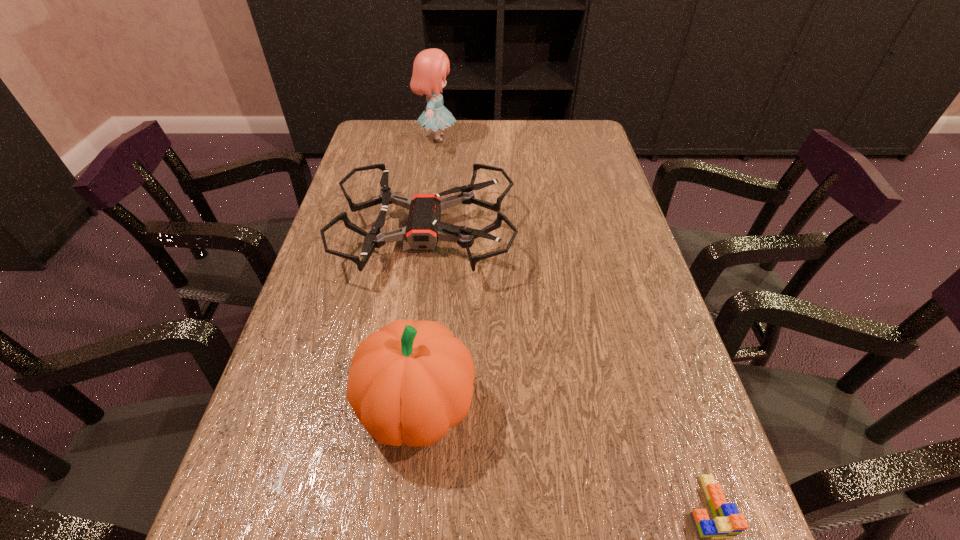
Select which object is the second closest to the rightmost object. Please provide its 2D coordinates. Your answer should be formatted as a tuple, i.e. [(x, y)], where the tuple contains the x and y coordinates of a point satisfying the conditions above.

[(424, 228)]

Find the location of a particular element. The width and height of the screenshot is (960, 540). free spot that satisfies the following two spatial constraints: 1. with the camera facing forward on the third nearest object; 2. on the left side of the third shortest object is located at coordinates (404, 406).

The image size is (960, 540). What are the coordinates of `vacant area in the image that satisfies the following two spatial constraints: 1. on the front-facing side of the doll; 2. on the back side of the third farthest object` in the screenshot? It's located at (400, 406).

The height and width of the screenshot is (540, 960). Find the location of `vacant region that satisfies the following two spatial constraints: 1. with the camera facing forward on the drone; 2. on the left side of the Lego`. vacant region that satisfies the following two spatial constraints: 1. with the camera facing forward on the drone; 2. on the left side of the Lego is located at coordinates (391, 507).

Identify the location of vacant space that satisfies the following two spatial constraints: 1. with the camera facing forward on the third shortest object; 2. on the left side of the drone. (404, 406).

Where is `vacant space that satisfies the following two spatial constraints: 1. with the camera facing forward on the second shortest object; 2. on the left side of the pumpkin`? The height and width of the screenshot is (540, 960). vacant space that satisfies the following two spatial constraints: 1. with the camera facing forward on the second shortest object; 2. on the left side of the pumpkin is located at coordinates (404, 406).

What are the coordinates of `vacant area in the image that satisfies the following two spatial constraints: 1. on the back side of the Lego; 2. on the front-facing side of the farthest object` in the screenshot? It's located at (585, 138).

The width and height of the screenshot is (960, 540). Identify the location of vacant space that satisfies the following two spatial constraints: 1. on the back side of the pumpkin; 2. on the front-facing side of the tallest object. (446, 138).

The width and height of the screenshot is (960, 540). Find the location of `free spot that satisfies the following two spatial constraints: 1. on the front side of the third shortest object; 2. on the left side of the Lego`. free spot that satisfies the following two spatial constraints: 1. on the front side of the third shortest object; 2. on the left side of the Lego is located at coordinates (407, 507).

Where is `vacant space that satisfies the following two spatial constraints: 1. on the front-facing side of the farthest object; 2. on the back side of the Lego`? The height and width of the screenshot is (540, 960). vacant space that satisfies the following two spatial constraints: 1. on the front-facing side of the farthest object; 2. on the back side of the Lego is located at coordinates (387, 507).